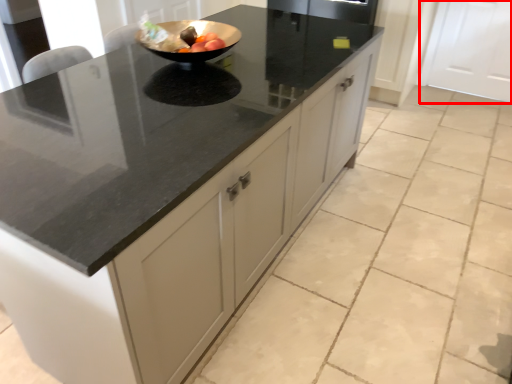
Question: From the image's perspective, where is cabinetry (annotated by the red box) located in relation to fruit in the image?

Choices:
 (A) below
 (B) above

Answer: (B)